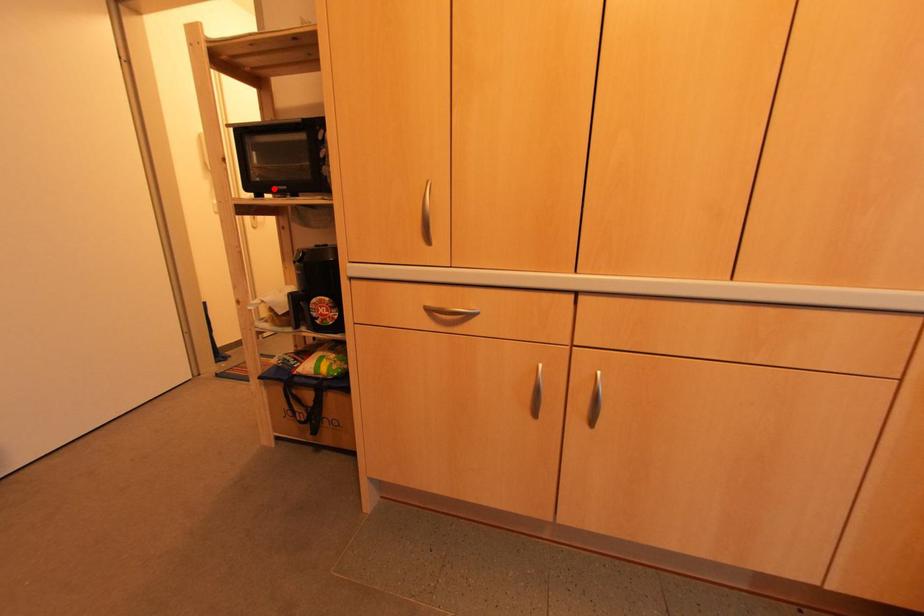
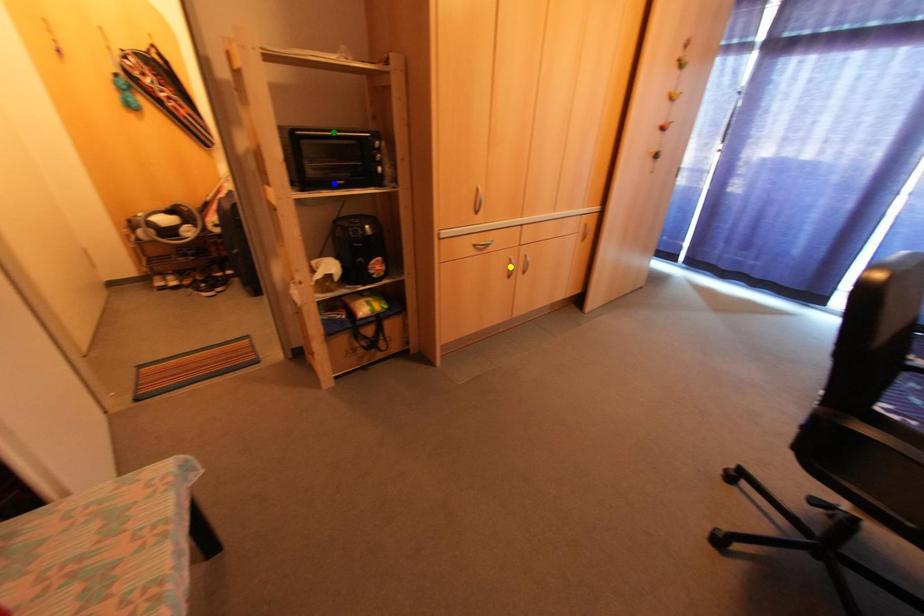
Question: I am providing you with two images of the same scene from different viewpoints. A red point is marked on the first image. You are given multiple points on the second image. In image 2, which mark is for the same physical point as the one in image 1?

Choices:
 (A) blue point
 (B) green point
 (C) yellow point

Answer: (A)